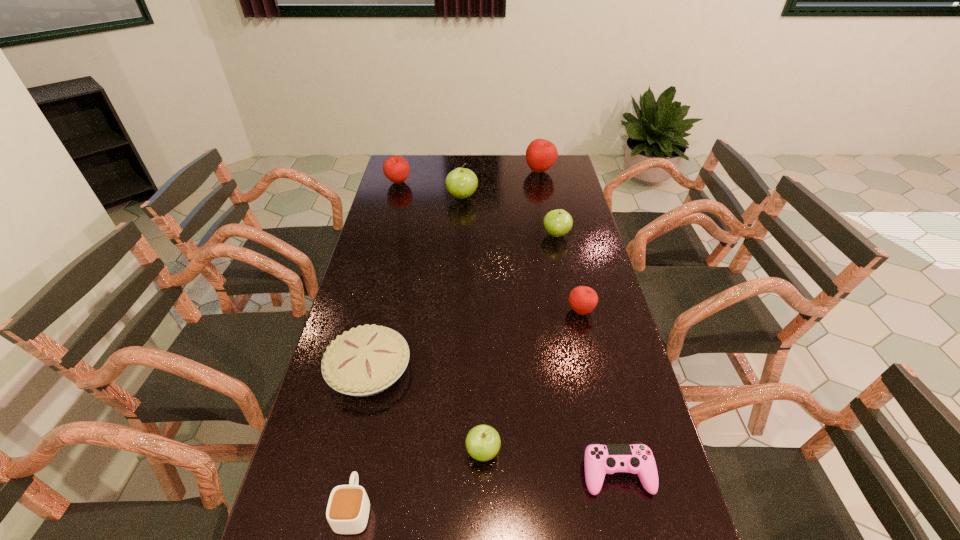
Locate an element on the screen. vacant area that lies between the farthest green apple and the nearest green apple is located at coordinates tap(472, 325).

At what (x,y) coordinates should I click in order to perform the action: click on empty space that is in between the control and the biggest green apple. Please return your answer as a coordinate pair (x, y). Looking at the image, I should click on (540, 335).

In order to click on free area in between the fourth nearest object and the nearest apple in this screenshot , I will do `click(426, 410)`.

Select which object is the eighth closest to the biggest red apple. Please provide its 2D coordinates. Your answer should be formatted as a tuple, i.e. [(x, y)], where the tuple contains the x and y coordinates of a point satisfying the conditions above.

[(348, 508)]

Identify which object is the seventh closest to the leftmost apple. Please provide its 2D coordinates. Your answer should be formatted as a tuple, i.e. [(x, y)], where the tuple contains the x and y coordinates of a point satisfying the conditions above.

[(348, 508)]

Select which apple appears as the fourth closest to the leftmost apple. Please provide its 2D coordinates. Your answer should be formatted as a tuple, i.e. [(x, y)], where the tuple contains the x and y coordinates of a point satisfying the conditions above.

[(582, 299)]

Select which apple appears as the fifth closest to the rightmost green apple. Please provide its 2D coordinates. Your answer should be formatted as a tuple, i.e. [(x, y)], where the tuple contains the x and y coordinates of a point satisfying the conditions above.

[(483, 442)]

Where is `green apple object that ranks as the second closest to the fifth nearest object`? This screenshot has height=540, width=960. green apple object that ranks as the second closest to the fifth nearest object is located at coordinates (483, 442).

Where is `green apple that is the third closest to the pie`? This screenshot has width=960, height=540. green apple that is the third closest to the pie is located at coordinates tap(461, 183).

The image size is (960, 540). I want to click on red apple that can be found as the closest to the fifth nearest object, so click(541, 154).